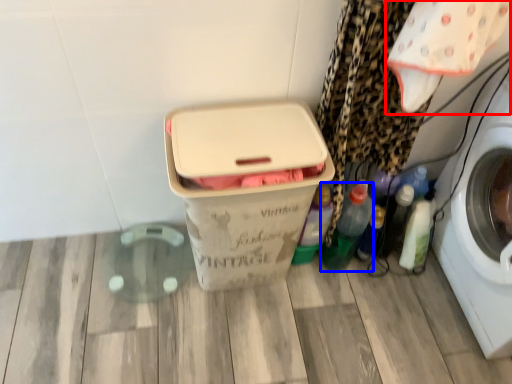
Question: Which point is closer to the camera, baby clothe (highlighted by a red box) or bottle (highlighted by a blue box)?

Choices:
 (A) baby clothe
 (B) bottle

Answer: (A)